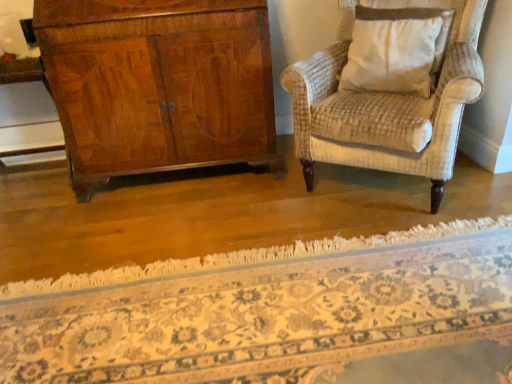
Question: From a real-world perspective, is beige textured pillow at upper right physically above floral carpet at center?

Choices:
 (A) yes
 (B) no

Answer: (A)

Question: Is beige textured pillow at upper right oriented towards floral carpet at center?

Choices:
 (A) no
 (B) yes

Answer: (A)

Question: From the image's perspective, would you say beige textured pillow at upper right is positioned over floral carpet at center?

Choices:
 (A) no
 (B) yes

Answer: (B)

Question: Is beige textured pillow at upper right completely or partially outside of floral carpet at center?

Choices:
 (A) yes
 (B) no

Answer: (A)

Question: From a real-world perspective, is beige textured pillow at upper right beneath floral carpet at center?

Choices:
 (A) no
 (B) yes

Answer: (A)

Question: Considering the relative positions of beige textured pillow at upper right and floral carpet at center in the image provided, is beige textured pillow at upper right to the left of floral carpet at center from the viewer's perspective?

Choices:
 (A) yes
 (B) no

Answer: (B)

Question: From a real-world perspective, is floral carpet at center below beige textured pillow at upper right?

Choices:
 (A) yes
 (B) no

Answer: (A)

Question: Does floral carpet at center have a lesser height compared to beige textured pillow at upper right?

Choices:
 (A) no
 (B) yes

Answer: (B)

Question: From a real-world perspective, is floral carpet at center on beige textured pillow at upper right?

Choices:
 (A) yes
 (B) no

Answer: (B)

Question: Is floral carpet at center to the right of beige textured pillow at upper right from the viewer's perspective?

Choices:
 (A) yes
 (B) no

Answer: (B)

Question: Is floral carpet at center not near beige textured pillow at upper right?

Choices:
 (A) no
 (B) yes

Answer: (A)

Question: Would you say floral carpet at center is outside beige textured pillow at upper right?

Choices:
 (A) yes
 (B) no

Answer: (A)

Question: From the image's perspective, is floral carpet at center located above or below beige textured pillow at upper right?

Choices:
 (A) below
 (B) above

Answer: (A)